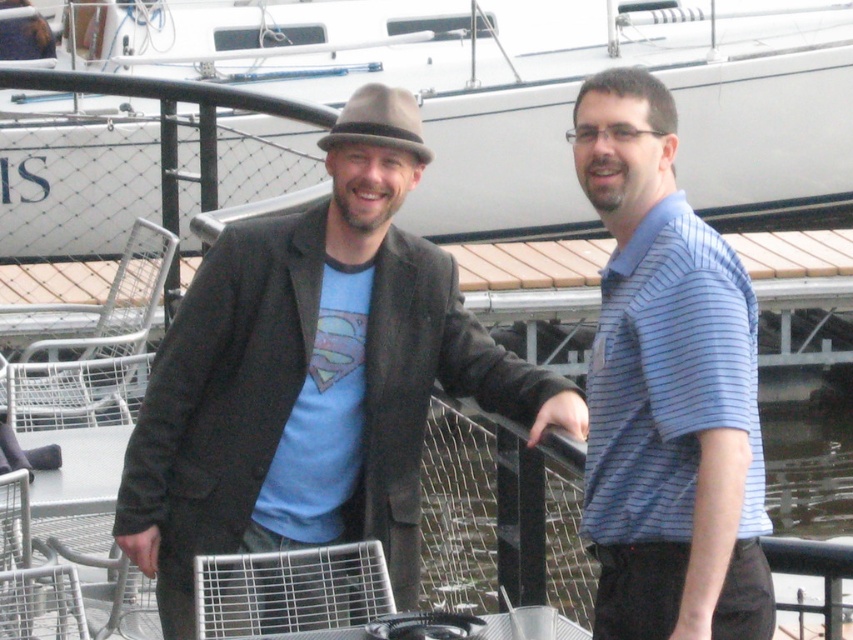
Question: Can you confirm if matte black jacket at center is smaller than blue striped polo shirt at center?

Choices:
 (A) no
 (B) yes

Answer: (A)

Question: Can you confirm if matte black jacket at center is positioned to the right of matte black hand at lower right?

Choices:
 (A) yes
 (B) no

Answer: (B)

Question: Which point is closer to the camera taking this photo?

Choices:
 (A) (703, 620)
 (B) (532, 420)
 (C) (579, 97)
 (D) (413, 134)

Answer: (A)

Question: Among these points, which one is nearest to the camera?

Choices:
 (A) (260, 45)
 (B) (225, 328)

Answer: (B)

Question: Does matte black jacket at center have a lesser width compared to black leather handle at center?

Choices:
 (A) no
 (B) yes

Answer: (A)

Question: Which object is farther from the camera taking this photo?

Choices:
 (A) matte black jacket at center
 (B) black leather handle at center
 (C) white matte boat at upper center
 (D) blue striped polo shirt at center

Answer: (C)